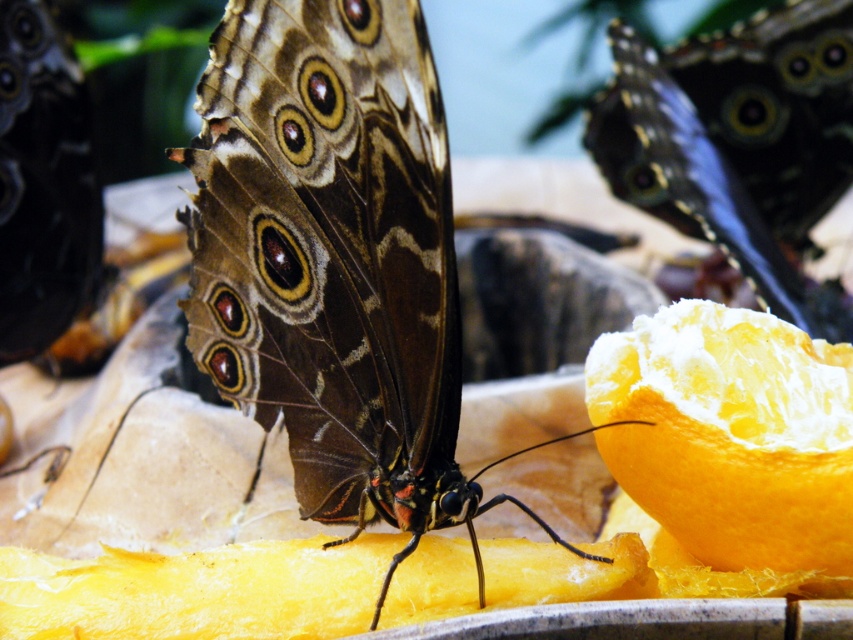
You are holding a magnifying glass and observing the shiny brown butterfly at center and the smooth orange at lower right. Which object is positioned to the left of the other?

The shiny brown butterfly at center is to the left of smooth orange at lower right.

You are a fruit vendor arranging fruits on a shelf. You have a smooth orange at lower right and a shiny blue butterfly at upper right nearby. Which object is shorter in height?

The smooth orange at lower right has a lesser height compared to the shiny blue butterfly at upper right, so the smooth orange at lower right is shorter in height.

You are an entomologist observing two butterflies in a garden. You see the shiny brown butterfly at center and the shiny blue butterfly at upper right. Which butterfly is positioned lower in the scene?

The shiny brown butterfly at center is positioned lower than the shiny blue butterfly at upper right.